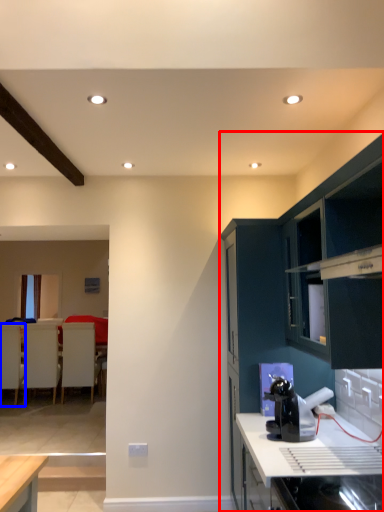
Question: Which of the following is the closest to the observer, cabinetry (highlighted by a red box) or armchair (highlighted by a blue box)?

Choices:
 (A) cabinetry
 (B) armchair

Answer: (A)